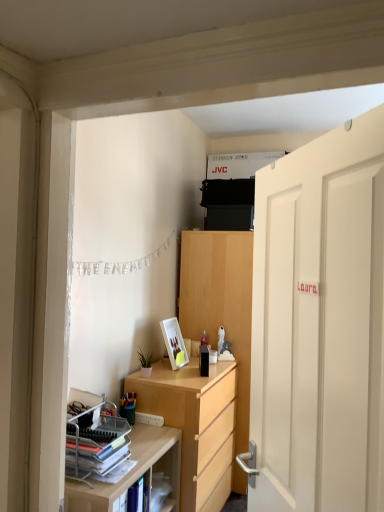
Question: From the image's perspective, is light wood shelf at lower left above white matte door at right?

Choices:
 (A) yes
 (B) no

Answer: (B)

Question: Does light wood shelf at lower left have a smaller size compared to white matte door at right?

Choices:
 (A) no
 (B) yes

Answer: (A)

Question: Is light wood shelf at lower left next to white matte door at right?

Choices:
 (A) no
 (B) yes

Answer: (A)

Question: Is light wood shelf at lower left not inside white matte door at right?

Choices:
 (A) yes
 (B) no

Answer: (A)

Question: From a real-world perspective, is light wood shelf at lower left physically below white matte door at right?

Choices:
 (A) no
 (B) yes

Answer: (B)

Question: In the image, is stacked matte paper at left positioned in front of or behind light wood desk at center?

Choices:
 (A) front
 (B) behind

Answer: (A)

Question: From a real-world perspective, relative to light wood desk at center, is stacked matte paper at left vertically above or below?

Choices:
 (A) above
 (B) below

Answer: (A)

Question: From the image's perspective, is stacked matte paper at left located above or below light wood desk at center?

Choices:
 (A) above
 (B) below

Answer: (A)

Question: Is stacked matte paper at left inside or outside of light wood desk at center?

Choices:
 (A) inside
 (B) outside

Answer: (B)

Question: In the image, is silver metallic banner at upper left on the left side or the right side of multicolored plastic pencil case at lower left?

Choices:
 (A) right
 (B) left

Answer: (A)

Question: From a real-world perspective, is silver metallic banner at upper left above or below multicolored plastic pencil case at lower left?

Choices:
 (A) below
 (B) above

Answer: (B)

Question: Considering the positions of silver metallic banner at upper left and multicolored plastic pencil case at lower left in the image, is silver metallic banner at upper left bigger or smaller than multicolored plastic pencil case at lower left?

Choices:
 (A) big
 (B) small

Answer: (A)

Question: Considering their positions, is silver metallic banner at upper left located in front of or behind multicolored plastic pencil case at lower left?

Choices:
 (A) behind
 (B) front

Answer: (B)

Question: In the image, is multicolored plastic pencil case at lower left on the left side or the right side of white glossy picture frame at lower center?

Choices:
 (A) left
 (B) right

Answer: (A)

Question: Is multicolored plastic pencil case at lower left inside or outside of white glossy picture frame at lower center?

Choices:
 (A) outside
 (B) inside

Answer: (A)